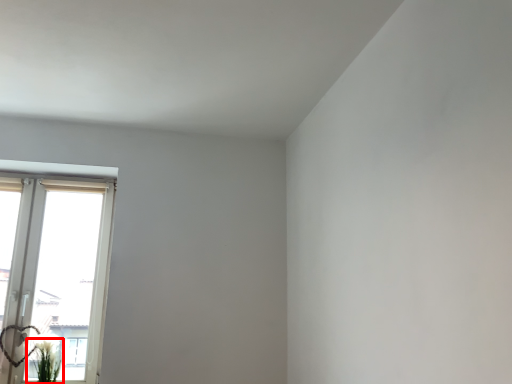
Question: Where is plant (annotated by the red box) located in relation to window in the image?

Choices:
 (A) left
 (B) right

Answer: (B)